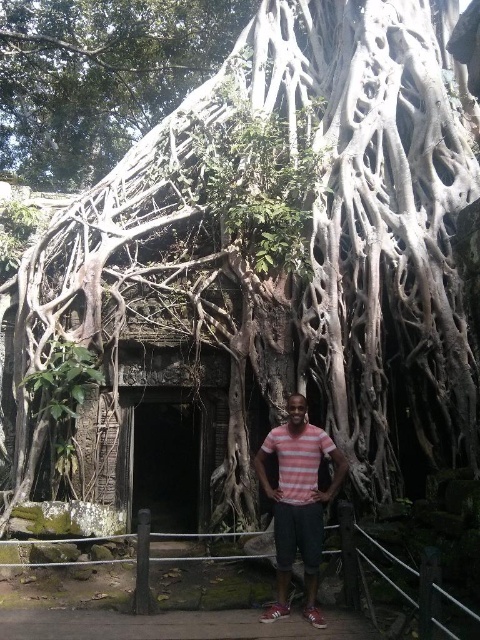
You are a GUI agent. You are given a task and a screenshot of the screen. Output one action in this format:
    pyautogui.click(x=<x>, y=<y>)
    Task: Click on the green rough bark tree at upper center
    
    Given the screenshot: What is the action you would take?
    pyautogui.click(x=99, y=77)

Is green rough bark tree at upper center wider than dark stone doorway at center?

Yes.

Find the location of `green rough bark tree at upper center`. green rough bark tree at upper center is located at coordinates (99, 77).

Identify the location of green rough bark tree at upper center. The width and height of the screenshot is (480, 640). click(x=99, y=77).

What do you see at coordinates (167, 458) in the screenshot? Image resolution: width=480 pixels, height=640 pixels. I see `dark stone doorway at center` at bounding box center [167, 458].

Is dark stone doorway at center below pink striped shirt at center?

Indeed, dark stone doorway at center is positioned under pink striped shirt at center.

This screenshot has width=480, height=640. Identify the location of dark stone doorway at center. (167, 458).

Which of these two, green rough bark tree at upper center or pink striped shirt at center, stands shorter?

pink striped shirt at center is shorter.

Measure the distance from green rough bark tree at upper center to pink striped shirt at center.

A distance of 17.30 meters exists between green rough bark tree at upper center and pink striped shirt at center.

The image size is (480, 640). I want to click on green rough bark tree at upper center, so click(x=99, y=77).